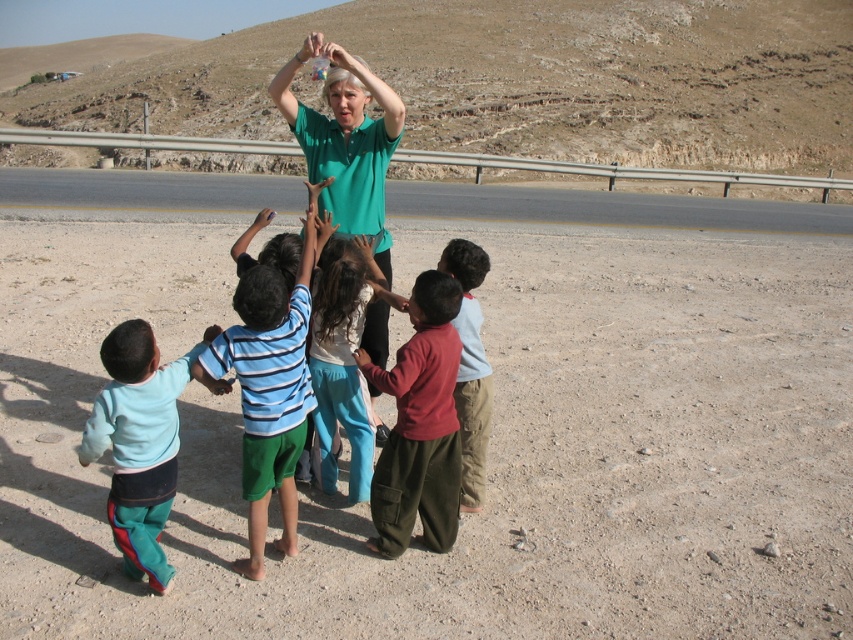
Question: Can you confirm if green matte shirt at upper center is smaller than smooth blue shirt at lower left?

Choices:
 (A) no
 (B) yes

Answer: (A)

Question: Estimate the real-world distances between objects in this image. Which object is farther from the maroon cotton shirt at center?

Choices:
 (A) light blue cotton pants at lower left
 (B) smooth blue shirt at lower left
 (C) asphalt road at center

Answer: (C)

Question: Among these objects, which one is nearest to the camera?

Choices:
 (A) smooth blue shirt at lower left
 (B) green matte shirt at upper center

Answer: (A)

Question: Can you confirm if light blue cotton pants at lower left is bigger than smooth skin hand at center?

Choices:
 (A) yes
 (B) no

Answer: (A)

Question: Which object is positioned closest to the maroon cotton shirt at center?

Choices:
 (A) blue striped shirt at center
 (B) smooth blue shirt at lower left
 (C) asphalt road at center
 (D) smooth skin hand at center

Answer: (A)

Question: Can you confirm if light blue cotton pants at lower left is positioned below smooth skin hand at center?

Choices:
 (A) yes
 (B) no

Answer: (A)